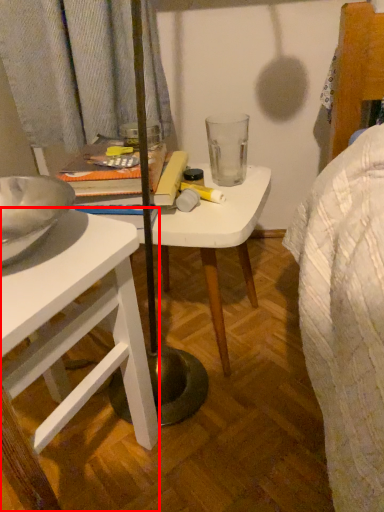
Question: From the image's perspective, considering the relative positions of desk (annotated by the red box) and table in the image provided, where is desk (annotated by the red box) located with respect to the staircase?

Choices:
 (A) below
 (B) above

Answer: (A)